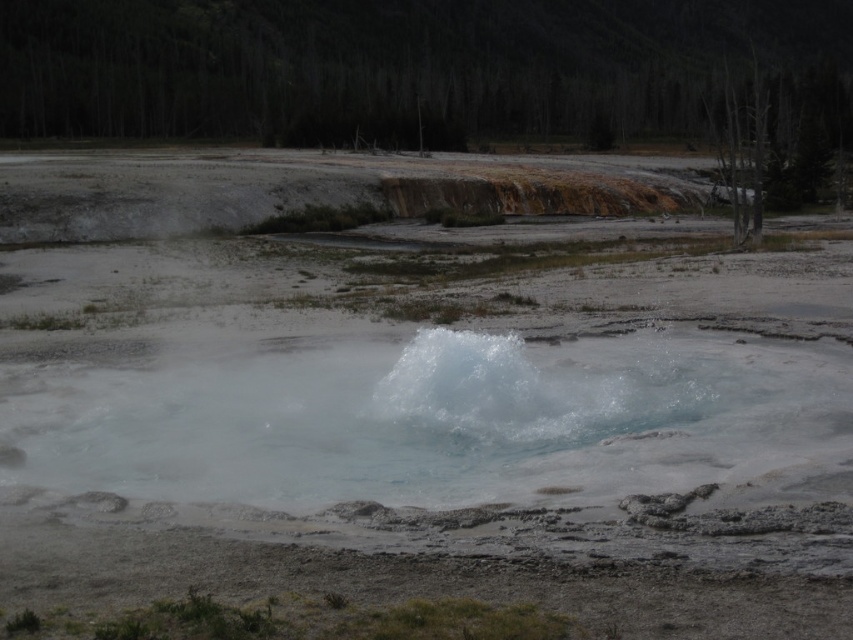
Question: Can you confirm if translucent white water at center is positioned above translucent water vapor at center?

Choices:
 (A) yes
 (B) no

Answer: (A)

Question: Is translucent white water at center above translucent water vapor at center?

Choices:
 (A) no
 (B) yes

Answer: (B)

Question: Among these objects, which one is nearest to the camera?

Choices:
 (A) translucent white water at center
 (B) translucent water vapor at center

Answer: (A)

Question: Does translucent white water at center appear on the left side of translucent water vapor at center?

Choices:
 (A) yes
 (B) no

Answer: (A)